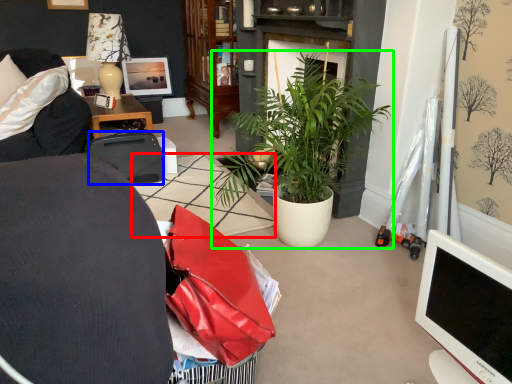
Question: Considering the real-world distances, which object is farthest from tile (highlighted by a red box)? luggage and bags (highlighted by a blue box) or houseplant (highlighted by a green box)?

Choices:
 (A) luggage and bags
 (B) houseplant

Answer: (B)